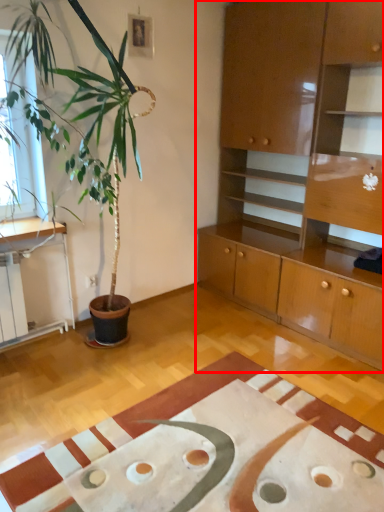
Question: Considering the relative positions of cabinetry (annotated by the red box) and plain in the image provided, where is cabinetry (annotated by the red box) located with respect to the staircase?

Choices:
 (A) left
 (B) right

Answer: (B)